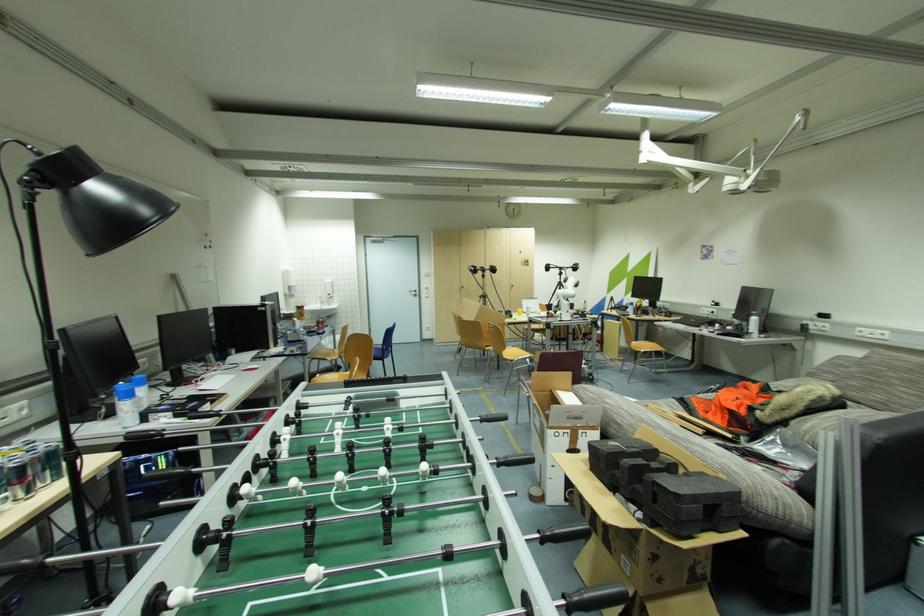
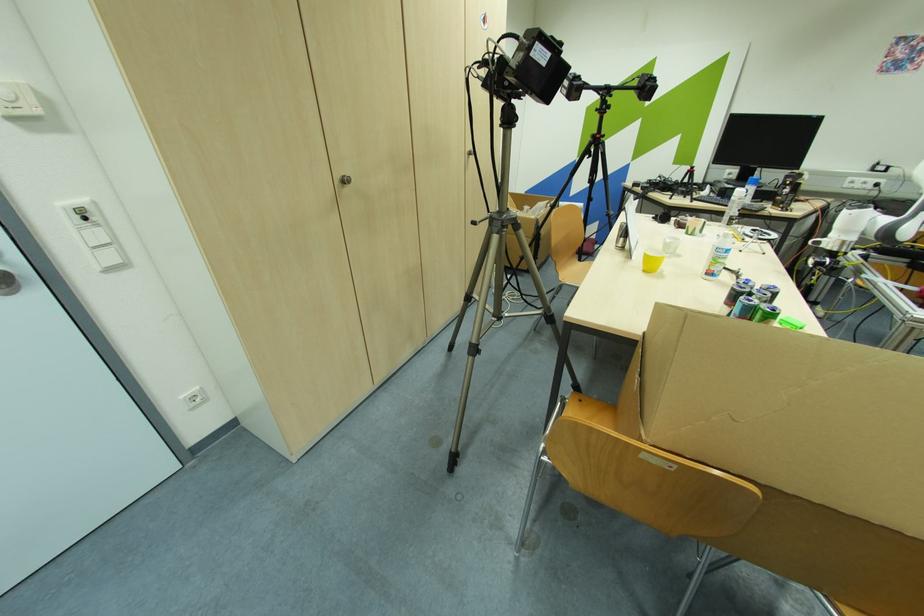
In the second image, find the point that corresponds to point 430,293 in the first image.

(102, 236)